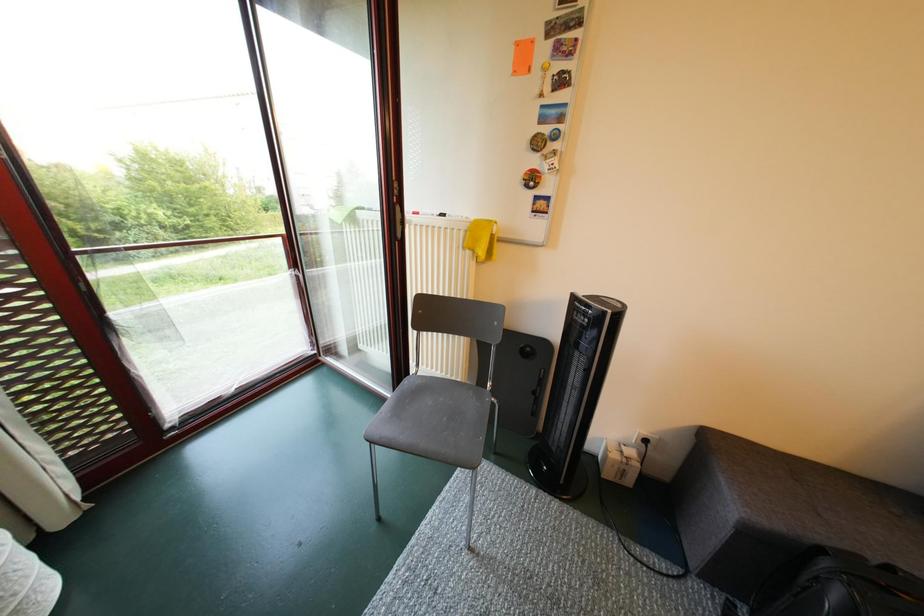
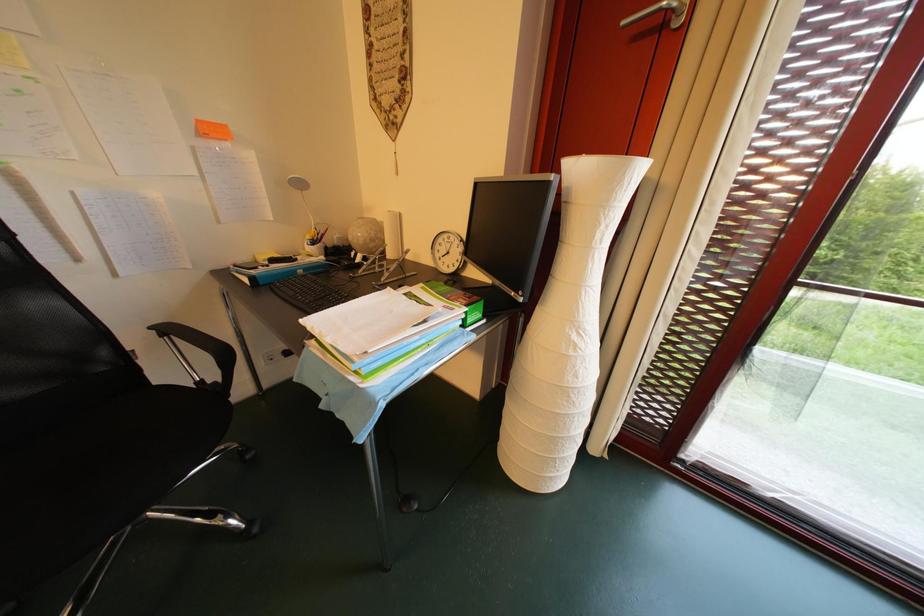
Based on the continuous images, in which direction is the camera rotating?

The rotation direction of the camera is left-down.